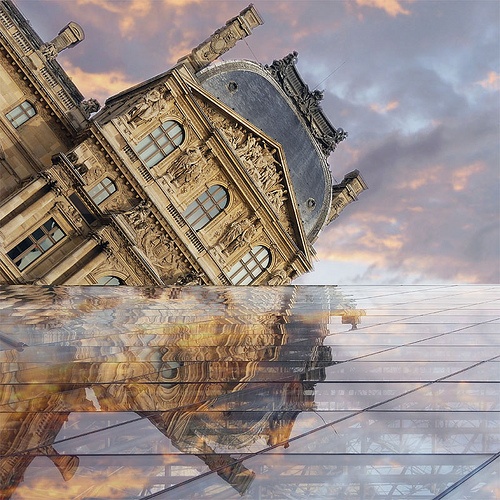
Identify the location of wall. (40, 139), (7, 89).